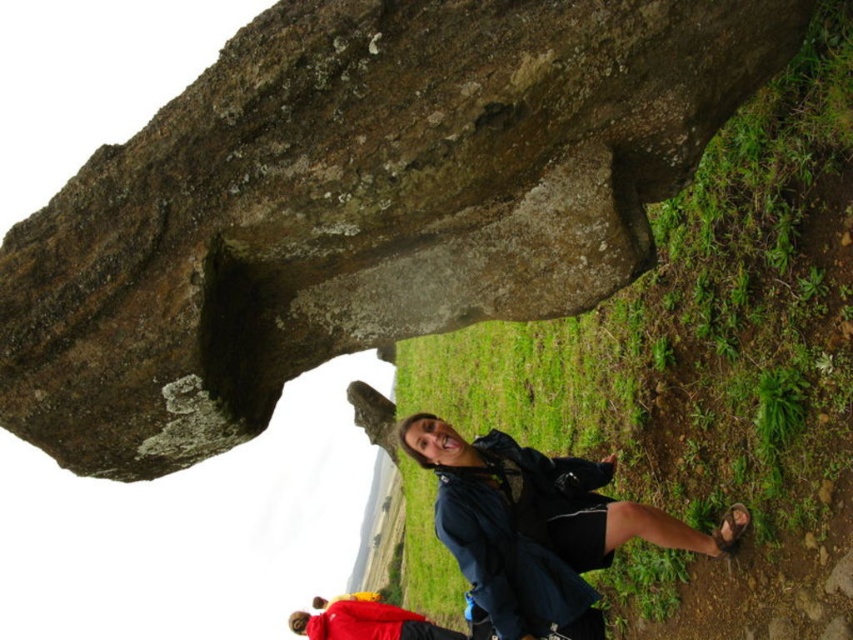
Question: Does rough stone boulder at upper center come in front of matte blue jacket at lower right?

Choices:
 (A) yes
 (B) no

Answer: (A)

Question: Can you confirm if rough stone boulder at upper center is wider than matte blue jacket at lower right?

Choices:
 (A) no
 (B) yes

Answer: (B)

Question: Which point is closer to the camera?

Choices:
 (A) rough stone boulder at upper center
 (B) matte blue jacket at lower right

Answer: (A)

Question: Is rough stone boulder at upper center further to the viewer compared to matte blue jacket at lower right?

Choices:
 (A) no
 (B) yes

Answer: (A)